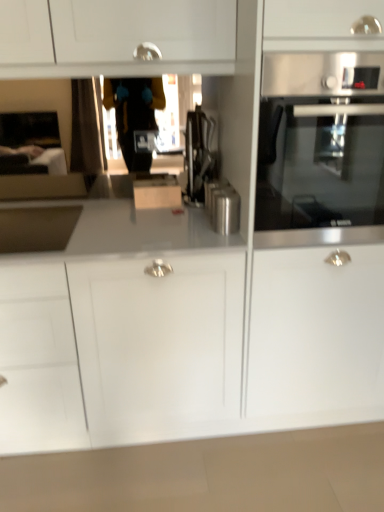
This screenshot has width=384, height=512. What do you see at coordinates (208, 474) in the screenshot?
I see `white glossy countertop at lower center` at bounding box center [208, 474].

What do you see at coordinates (320, 147) in the screenshot? I see `stainless steel oven at right` at bounding box center [320, 147].

Where is `white glossy countertop at lower center`? white glossy countertop at lower center is located at coordinates (208, 474).

Are satin nickel sink at left and satin metallic canister at center located far from each other?

Actually, satin nickel sink at left and satin metallic canister at center are a little close together.

From a real-world perspective, relative to satin metallic canister at center, is satin nickel sink at left vertically above or below?

satin nickel sink at left is situated lower than satin metallic canister at center in the real world.

Is satin nickel sink at left at the left side of satin metallic canister at center?

Indeed, satin nickel sink at left is positioned on the left side of satin metallic canister at center.

Find the location of a particular element. Image resolution: width=384 pixels, height=512 pixels. sink below the satin black coffee machine at center (from a real-world perspective) is located at coordinates click(37, 228).

From the image's perspective, is satin black coffee machine at center positioned above or below satin nickel sink at left?

satin black coffee machine at center is above satin nickel sink at left.

Which is behind, satin black coffee machine at center or satin nickel sink at left?

satin black coffee machine at center is more distant.

Between satin black coffee machine at center and satin nickel sink at left, which one appears on the left side from the viewer's perspective?

satin nickel sink at left.

Is satin black coffee machine at center facing towards stainless steel oven at right?

No, satin black coffee machine at center is not oriented towards stainless steel oven at right.

Considering the sizes of satin black coffee machine at center and stainless steel oven at right in the image, is satin black coffee machine at center taller or shorter than stainless steel oven at right?

satin black coffee machine at center is shorter than stainless steel oven at right.

What's the angular difference between satin black coffee machine at center and stainless steel oven at right's facing directions?

There is a 3.21-degree angle between the facing directions of satin black coffee machine at center and stainless steel oven at right.

Considering the positions of point (237, 455) and point (63, 211), is point (237, 455) closer or farther from the camera than point (63, 211)?

Point (237, 455).

Looking at this image, how different are the orientations of white glossy countertop at lower center and satin nickel sink at left in degrees?

The angle between the facing direction of white glossy countertop at lower center and the facing direction of satin nickel sink at left is 90 degrees.

Identify the location of sink above the white glossy countertop at lower center (from a real-world perspective). (37, 228).

Can you confirm if white glossy countertop at lower center is smaller than satin nickel sink at left?

No, white glossy countertop at lower center is not smaller than satin nickel sink at left.

From the image's perspective, which is above, white glossy countertop at lower center or satin black coffee machine at center?

From the image's view, satin black coffee machine at center is above.

Does white glossy countertop at lower center come in front of satin black coffee machine at center?

Yes, it is.

Could you tell me if white glossy countertop at lower center is facing satin black coffee machine at center?

No.

Which of these two, stainless steel oven at right or satin metallic canister at center, is thinner?

satin metallic canister at center.

From the image's perspective, between stainless steel oven at right and satin metallic canister at center, who is located below?

satin metallic canister at center, from the image's perspective.

Is stainless steel oven at right to the left or to the right of satin metallic canister at center in the image?

stainless steel oven at right is positioned on satin metallic canister at center's right side.

Is stainless steel oven at right bigger than satin metallic canister at center?

Indeed, stainless steel oven at right has a larger size compared to satin metallic canister at center.

Which of these two, satin metallic canister at center or white glossy countertop at lower center, is smaller?

Smaller between the two is satin metallic canister at center.

Considering the relative sizes of satin metallic canister at center and white glossy countertop at lower center in the image provided, is satin metallic canister at center taller than white glossy countertop at lower center?

Indeed, satin metallic canister at center has a greater height compared to white glossy countertop at lower center.

At what (x,y) coordinates should I click in order to perform the action: click on kitchen appliance located behind the white glossy countertop at lower center. Please return your answer as a coordinate pair (x, y). Looking at the image, I should click on (225, 210).

How different are the orientations of satin metallic canister at center and white glossy countertop at lower center in degrees?

93.2 degrees separate the facing orientations of satin metallic canister at center and white glossy countertop at lower center.

This screenshot has height=512, width=384. Identify the location of sink below the satin metallic canister at center (from the image's perspective). click(37, 228).

The height and width of the screenshot is (512, 384). In order to click on sink on the left of the satin black coffee machine at center in this screenshot , I will do `click(37, 228)`.

Looking at the image, which one is located further to satin metallic canister at center, white glossy countertop at lower center or satin black coffee machine at center?

white glossy countertop at lower center.

Based on their spatial positions, is satin black coffee machine at center or satin nickel sink at left closer to stainless steel oven at right?

satin black coffee machine at center is closer to stainless steel oven at right.

When comparing their distances from white glossy countertop at lower center, does satin black coffee machine at center or satin metallic canister at center seem further?

satin black coffee machine at center lies further to white glossy countertop at lower center than the other object.

When comparing their distances from satin black coffee machine at center, does stainless steel oven at right or white glossy countertop at lower center seem closer?

The object closer to satin black coffee machine at center is stainless steel oven at right.

Based on their spatial positions, is satin nickel sink at left or satin metallic canister at center further from satin black coffee machine at center?

satin nickel sink at left.

When comparing their distances from white glossy countertop at lower center, does satin nickel sink at left or stainless steel oven at right seem closer?

The object closer to white glossy countertop at lower center is satin nickel sink at left.

Looking at the image, which one is located further to white glossy countertop at lower center, satin metallic canister at center or stainless steel oven at right?

stainless steel oven at right lies further to white glossy countertop at lower center than the other object.

Which object lies further to the anchor point white glossy countertop at lower center, stainless steel oven at right or satin nickel sink at left?

Among the two, stainless steel oven at right is located further to white glossy countertop at lower center.

Where is `sink that lies between satin black coffee machine at center and white glossy countertop at lower center from top to bottom`? The height and width of the screenshot is (512, 384). sink that lies between satin black coffee machine at center and white glossy countertop at lower center from top to bottom is located at coordinates (37, 228).

Find the location of a particular element. sink between stainless steel oven at right and white glossy countertop at lower center from top to bottom is located at coordinates (37, 228).

You are a GUI agent. You are given a task and a screenshot of the screen. Output one action in this format:
    pyautogui.click(x=<x>, y=<y>)
    Task: Click on the coffee machine between satin nickel sink at left and satin metallic canister at center from left to right
    The width and height of the screenshot is (384, 512).
    Given the screenshot: What is the action you would take?
    pyautogui.click(x=198, y=155)

Locate an element on the screen. coffee machine located between satin nickel sink at left and stainless steel oven at right in the left-right direction is located at coordinates (198, 155).